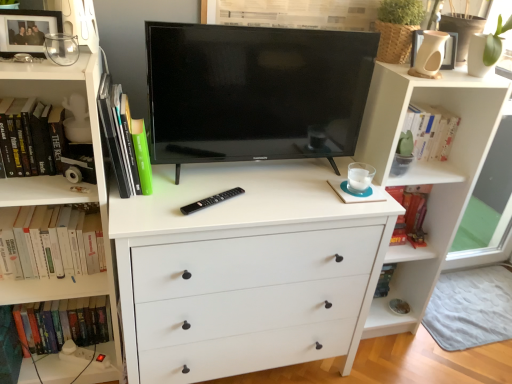
Where is `vacant space in front of green matte book at left, marked as the second book in a top-to-bottom arrangement`? The height and width of the screenshot is (384, 512). vacant space in front of green matte book at left, marked as the second book in a top-to-bottom arrangement is located at coordinates (139, 219).